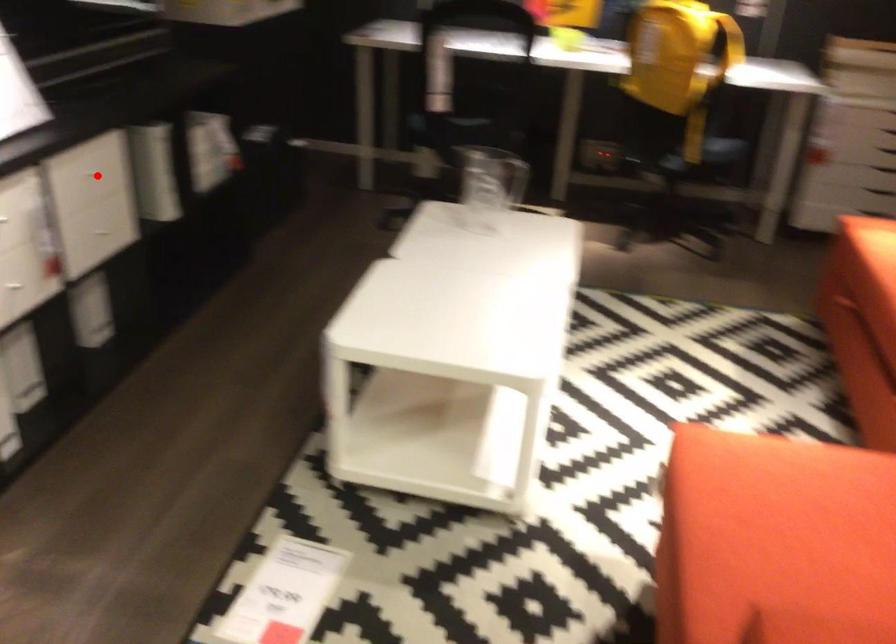
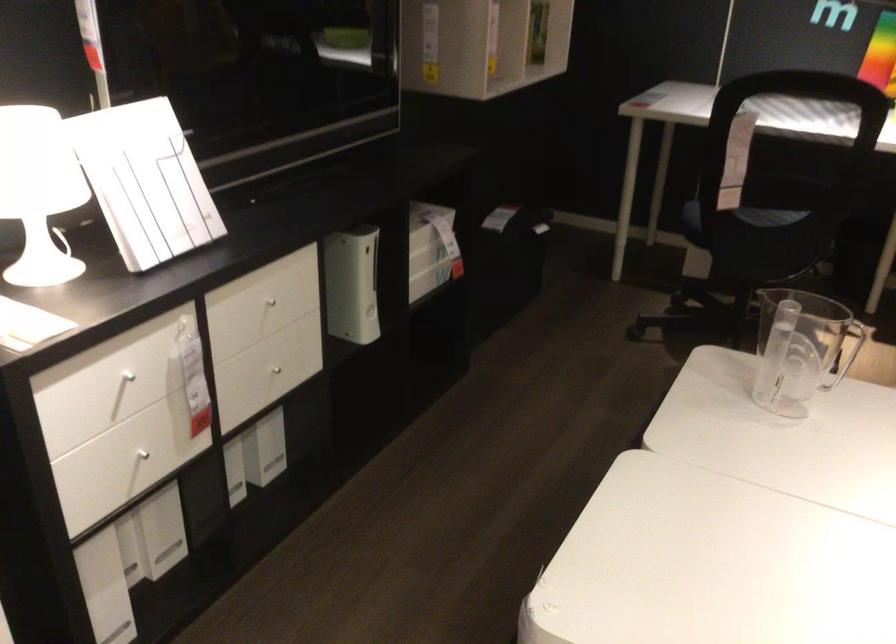
Question: I am providing you with two images of the same scene from different viewpoints. In image1, a red point is highlighted. Considering the same 3D point in image2, which of the following is correct?

Choices:
 (A) It is closer
 (B) It is farther

Answer: (A)